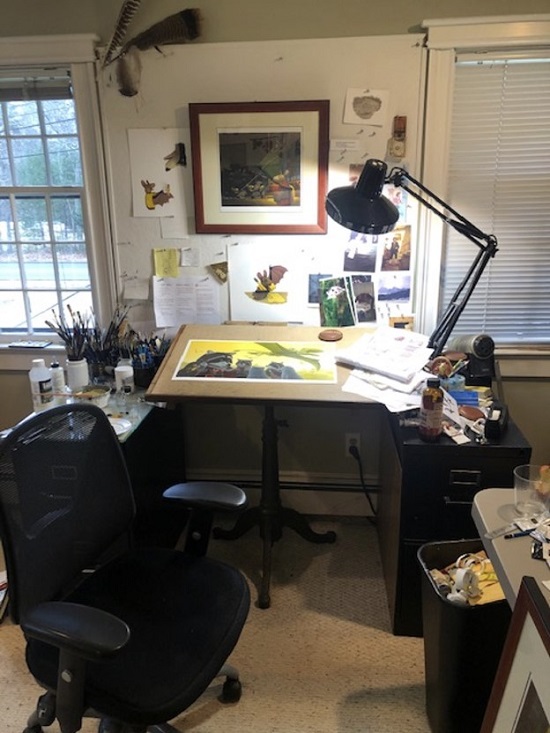
The height and width of the screenshot is (733, 550). I want to click on nasty carpet floor, off white, so click(374, 677).